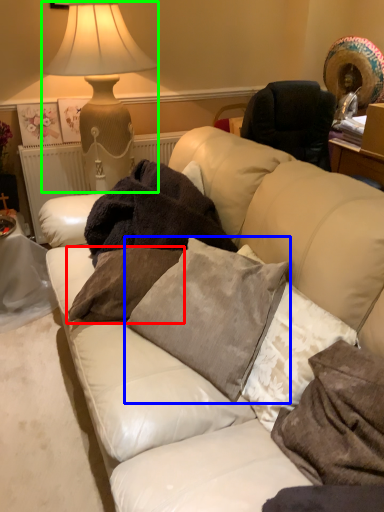
Question: Which is nearer to the pillow (highlighted by a red box)? pillow (highlighted by a blue box) or table lamp (highlighted by a green box).

Choices:
 (A) pillow
 (B) table lamp

Answer: (A)